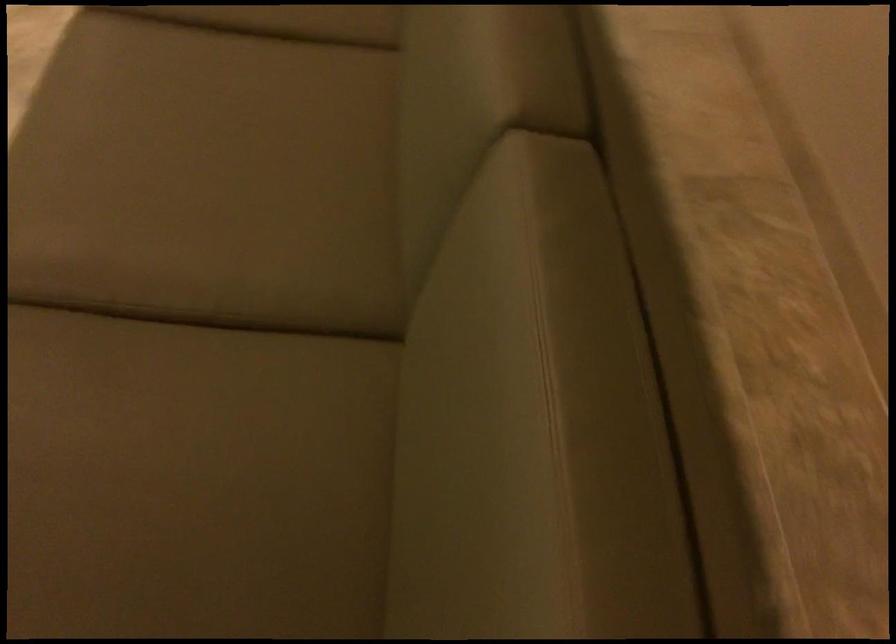
This screenshot has height=644, width=896. Identify the location of beige sofa surface. (211, 339).